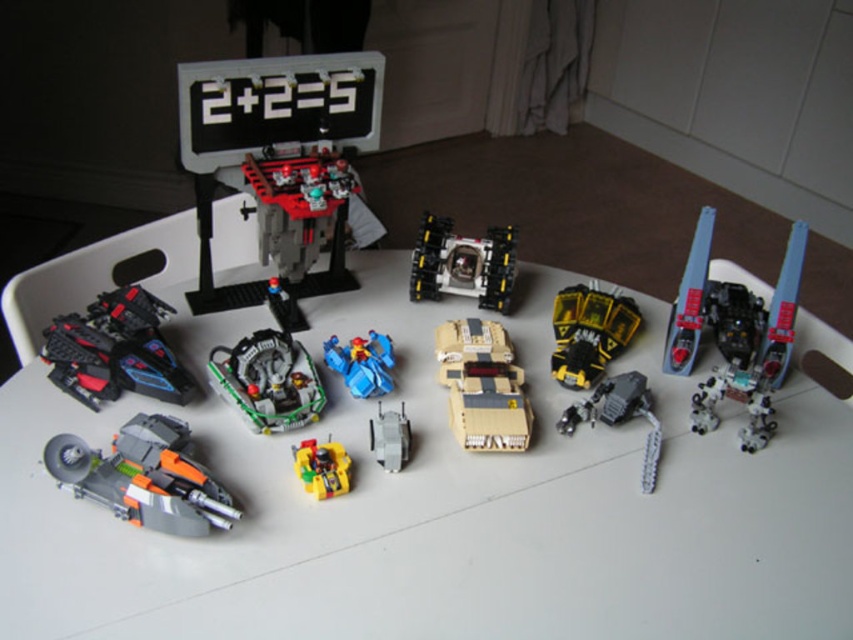
Question: Does shiny black spaceship at left have a lesser width compared to yellow matte truck at center?

Choices:
 (A) no
 (B) yes

Answer: (A)

Question: Which object appears closest to the camera in this image?

Choices:
 (A) matte black vehicle at center
 (B) shiny black spaceship at left
 (C) metallic gray robot at lower right

Answer: (C)

Question: Where is black plastic spaceship at center located in relation to yellow matte/soft plastic toy at center in the image?

Choices:
 (A) left
 (B) right

Answer: (B)

Question: In this image, where is tan matte tank at center located relative to yellow matte/soft plastic toy at center?

Choices:
 (A) below
 (B) above

Answer: (B)

Question: Which of the following is the closest to the observer?

Choices:
 (A) tan matte tank at center
 (B) white plastic tray at center
 (C) black plastic spaceship at center

Answer: (B)

Question: Which object is closer to the camera taking this photo?

Choices:
 (A) yellow matte truck at center
 (B) black plastic spaceship at center
 (C) metallic silver robot at lower right

Answer: (C)